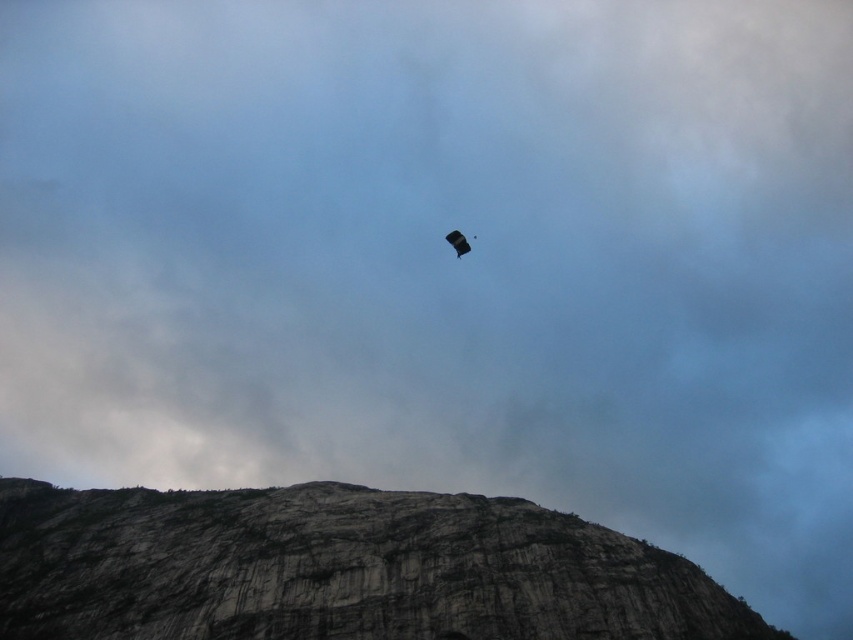
Based on the photo, you are a hiker who has just landed with your parachute in this mountainous area. You need to decide whether to leave your matte black parachute at center near the gray rock formation at center. Considering the width of both objects, will the parachute fit next to the rock formation without overlapping?

The gray rock formation at center might be wider than matte black parachute at center, so there is a possibility that the parachute could fit next to it without overlapping, but there is uncertainty due to the comparative width.

You are a hiker who has just reached the summit of the mountain. You look down and see the gray rock formation at center and the matte black parachute at center. Which object is taller from your viewpoint?

The matte black parachute at center is taller than the gray rock formation at center.